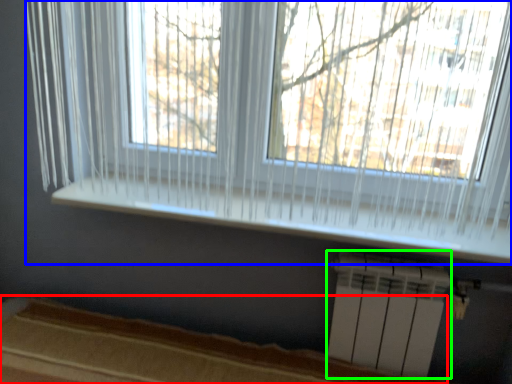
Question: Estimate the real-world distances between objects in this image. Which object is closer to bed frame (highlighted by a red box), window (highlighted by a blue box) or air conditioning (highlighted by a green box)?

Choices:
 (A) window
 (B) air conditioning

Answer: (B)